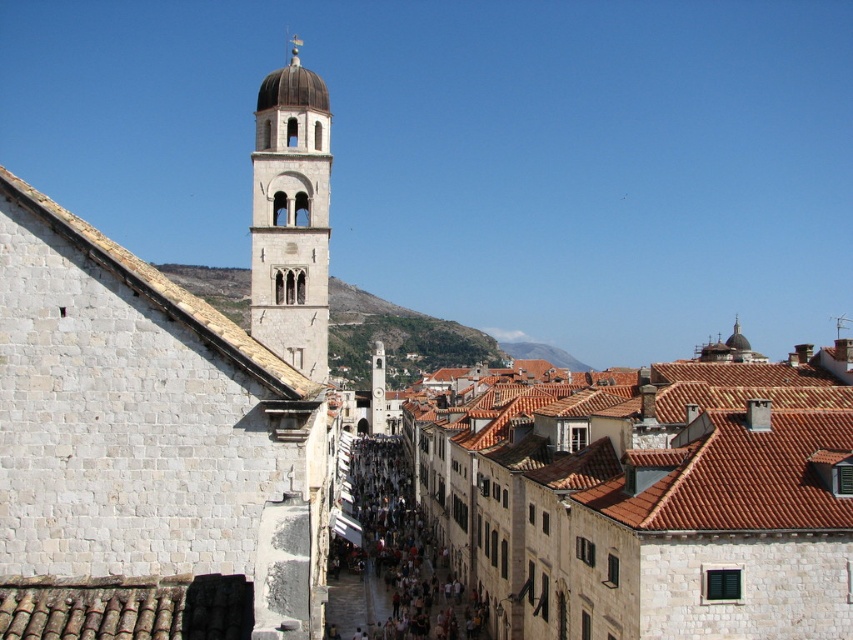
Looking at this image, you are a tourist standing on the street in front of the light beige stone bell tower at center and the dark brown stone crowd at center. Which object is closer to you?

The dark brown stone crowd at center is closer to you because the light beige stone bell tower at center is positioned over it, indicating the tower is behind the crowd.

You are standing on a cobblestone street in the historic town and want to take a photo of both the white stone tower at upper left and the light beige stone bell tower at center. Which tower should you focus on first to ensure both are in the frame?

You should focus on the white stone tower at upper left first because it is closer to you than the light beige stone bell tower at center, so adjusting the camera to include both would require starting with the closer one.

You are a tourist standing on the narrow street and want to take a photo of the light beige stone bell tower at center and the dark brown stone crowd at center. Which object should you frame first in your camera to ensure both are in the shot?

You should frame the light beige stone bell tower at center first since it is positioned on the left side of the dark brown stone crowd at center, so by starting with the bell tower, you can ensure the crowd is also captured to its right.